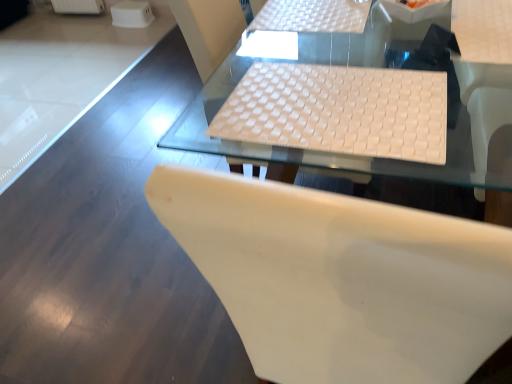
Question: Is white matte chair at center taller or shorter than white woven mat at center, the second table in the top-to-bottom sequence?

Choices:
 (A) short
 (B) tall

Answer: (A)

Question: Considering their positions, is white matte chair at center located in front of or behind white woven mat at center, which is counted as the first table, starting from the bottom?

Choices:
 (A) behind
 (B) front

Answer: (B)

Question: Based on their relative distances, which object is nearer to the white matte chair at center?

Choices:
 (A) white woven mat at upper center, which is counted as the first table, starting from the top
 (B) white woven mat at center, which is counted as the first table, starting from the bottom
 (C) white woven fabric laptop keyboard at center

Answer: (C)

Question: Which object is the farthest from the white matte chair at center?

Choices:
 (A) white woven mat at upper center, which is counted as the first table, starting from the top
 (B) white woven fabric laptop keyboard at center
 (C) white woven mat at center, which is counted as the first table, starting from the bottom

Answer: (A)